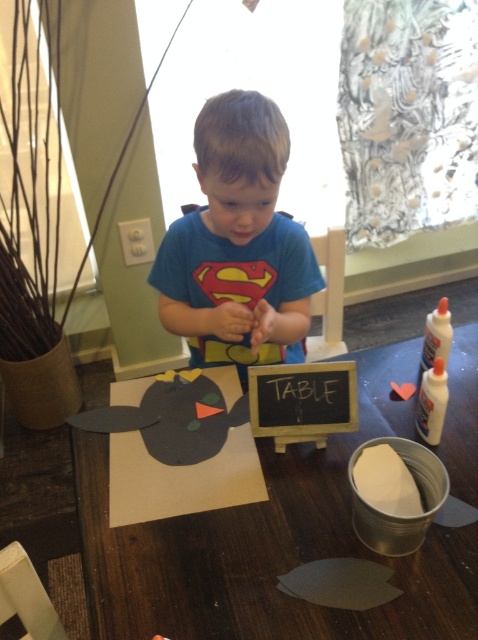
The child is trying to place their blue cotton shirt at center on the matte cardboard table at center. Considering the size of both objects, will the shirt fit entirely on the table?

The matte cardboard table at center has a larger size compared to blue cotton shirt at center, so the shirt will fit entirely on the table.

You are a parent observing your child at the craft table. The child is wearing a blue cotton shirt and standing at a matte cardboard table. Since you need to adjust the table height for their comfort, can you determine which is taller between the matte cardboard table at center and the blue cotton shirt at center?

The blue cotton shirt at center is taller than the matte cardboard table at center, so the table might be too low for the child. Consider raising it to match the shirt height for better posture.

The child is trying to place a new craft item on the table. Considering the space available, which object from the scene has a greater width, the matte cardboard table at center or the blue cotton shirt at center?

The matte cardboard table at center has a greater width than the blue cotton shirt at center.